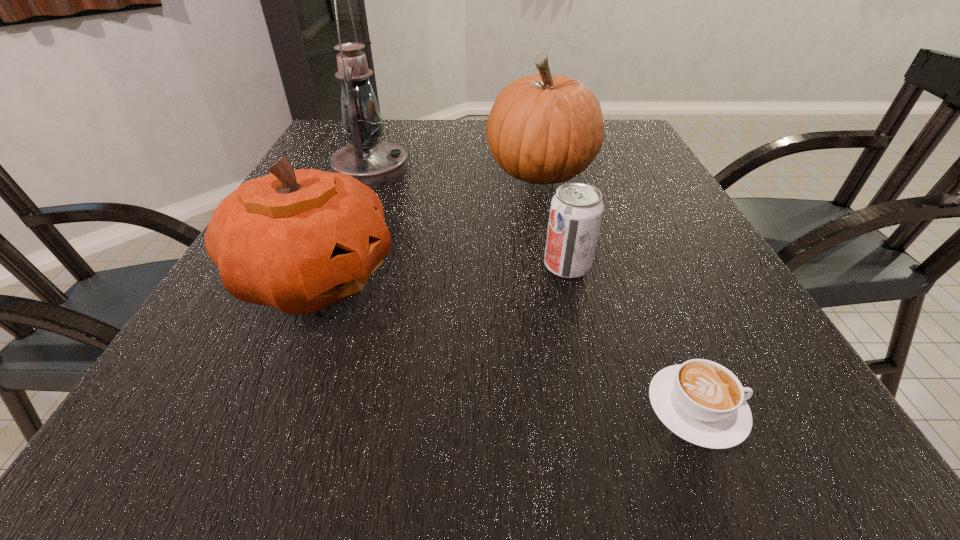
Where is `the tallest object`? The image size is (960, 540). the tallest object is located at coordinates (375, 163).

Locate an element on the screen. This screenshot has height=540, width=960. the right pumpkin is located at coordinates (543, 129).

Find the location of a particular element. the taller pumpkin is located at coordinates (543, 129).

Image resolution: width=960 pixels, height=540 pixels. I want to click on the shorter pumpkin, so click(x=300, y=240).

The width and height of the screenshot is (960, 540). Find the location of `the third tallest object`. the third tallest object is located at coordinates (300, 240).

You are a GUI agent. You are given a task and a screenshot of the screen. Output one action in this format:
    pyautogui.click(x=<x>, y=<y>)
    Task: Click on the fourth tallest object
    
    Given the screenshot: What is the action you would take?
    pyautogui.click(x=576, y=210)

Image resolution: width=960 pixels, height=540 pixels. In order to click on the nearest object in this screenshot , I will do 701,401.

This screenshot has width=960, height=540. I want to click on cappuccino, so click(x=701, y=401).

I want to click on vacant space located on the front of the tallest object, so click(319, 301).

Identify the location of vacant region located 0.360m on the stem of the taller pumpkin. (341, 173).